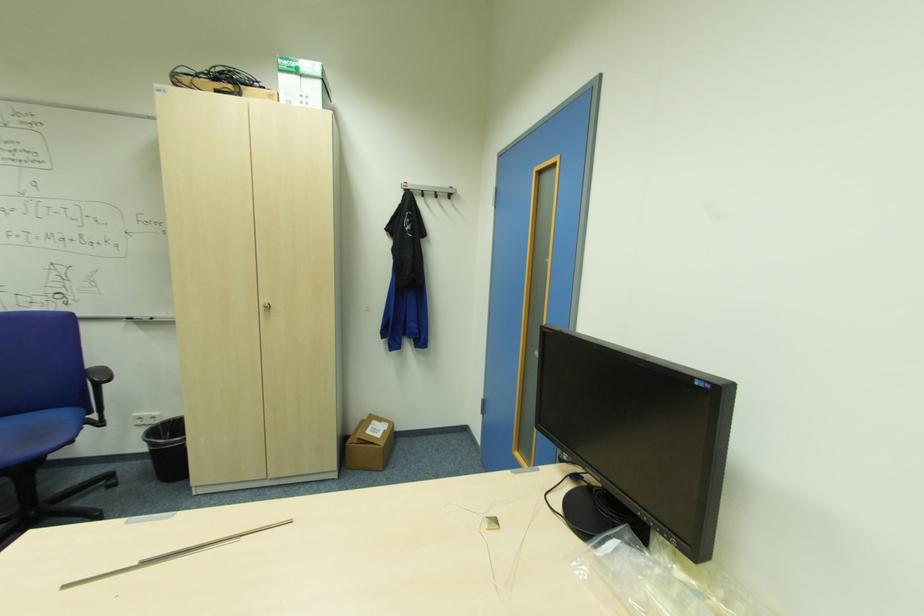
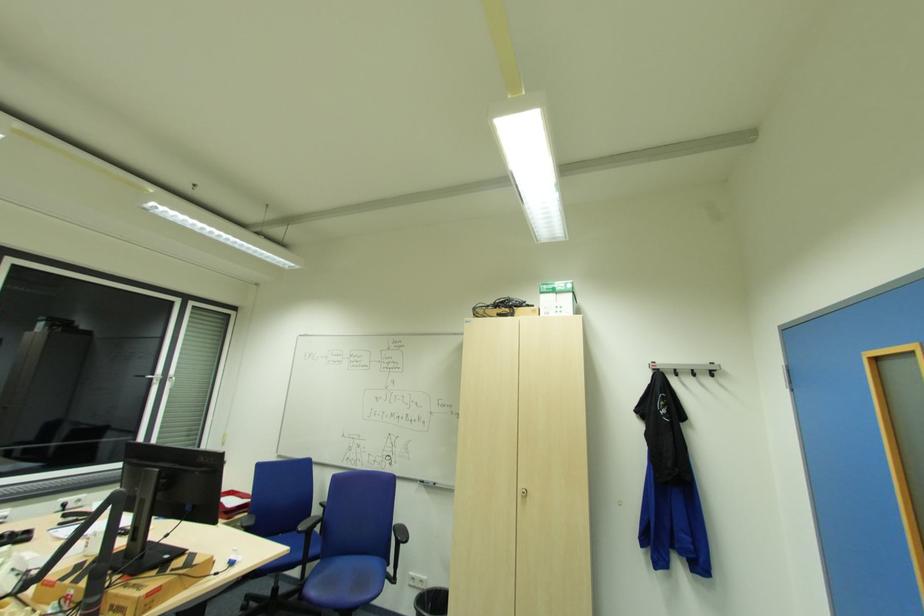
The first image is from the beginning of the video and the second image is from the end. How did the camera likely rotate when shooting the video?

The camera rotated toward left-up.